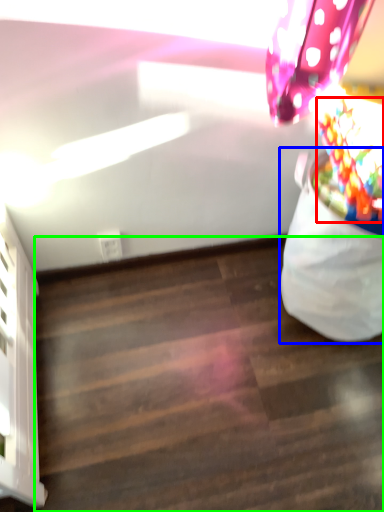
Question: Which object is positioned closest to flower (highlighted by a red box)? Select from bean bag chair (highlighted by a blue box) and stairwell (highlighted by a green box).

Choices:
 (A) bean bag chair
 (B) stairwell

Answer: (A)